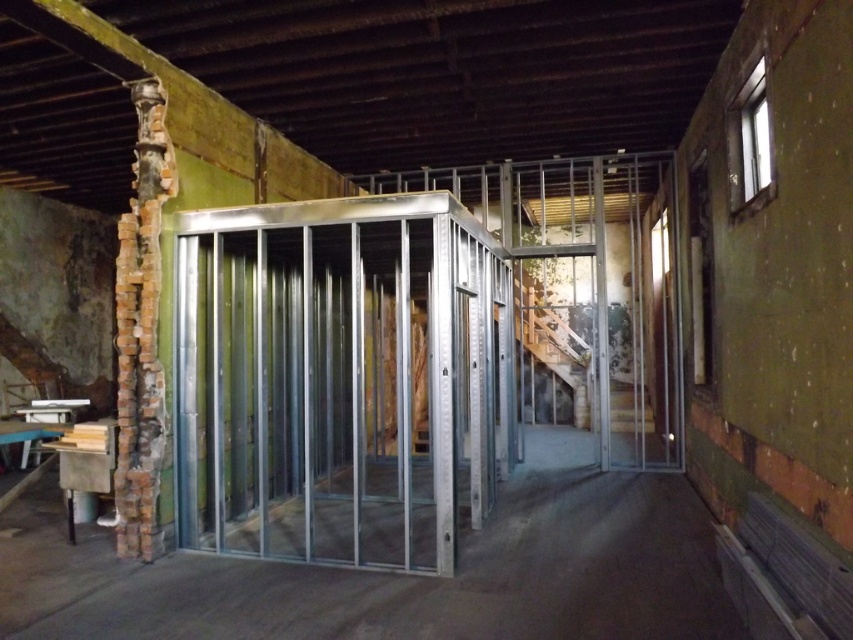
Looking at this image, between silver metallic elevator at center and metal frame at center, which one is positioned lower?

Positioned lower is metal frame at center.

Between silver metallic elevator at center and metal frame at center, which one is positioned higher?

silver metallic elevator at center is above.

Which is in front, point (204, 488) or point (466, 628)?

Point (466, 628)

Locate an element on the screen. The width and height of the screenshot is (853, 640). silver metallic elevator at center is located at coordinates (341, 378).